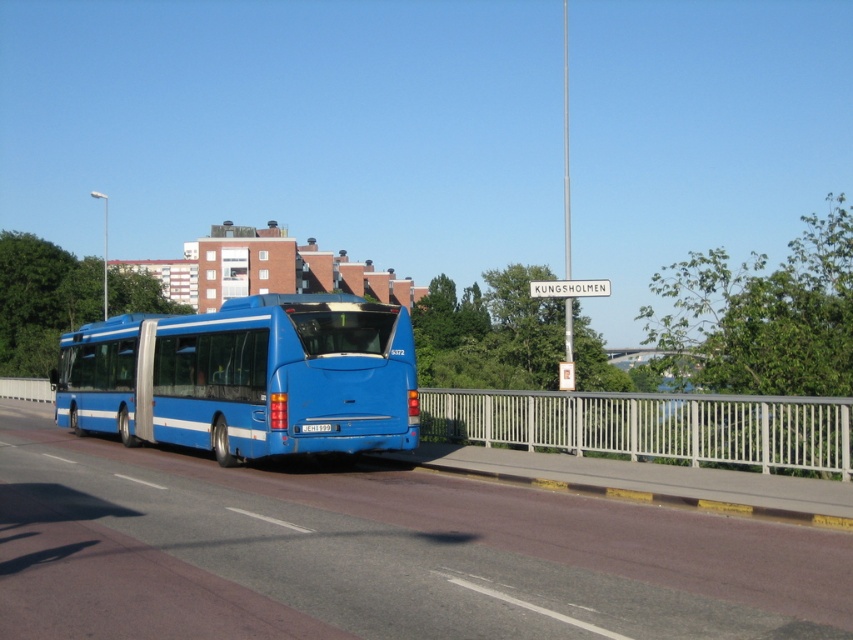
You are a pedestrian standing on the bridge and want to cross from the blue metallic bus at center to the blue rubber highway at center. Can you safely walk directly between them?

The blue rubber highway at center is 12.75 feet away from the blue metallic bus at center, so yes, you can safely walk directly between them since the distance is sufficient for a pedestrian to cross without difficulty.

You are a pedestrian standing on the bridge and see the blue metallic bus at center and the white plastic street sign at upper center. Which object is closer to you?

The blue metallic bus at center is closer to you because it is in front of the white plastic street sign at upper center.